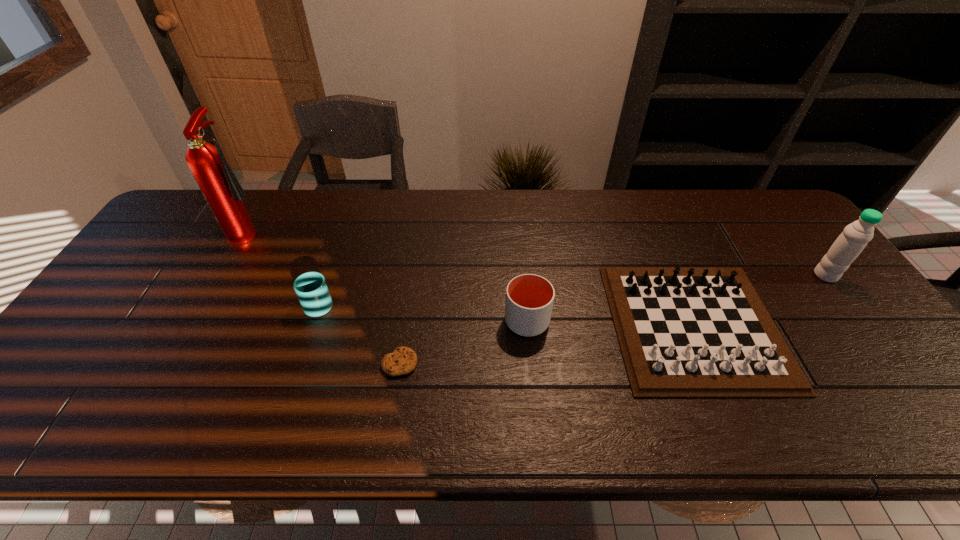
Where is `the leftmost object`? the leftmost object is located at coordinates (220, 187).

What are the coordinates of `the farthest object` in the screenshot? It's located at (220, 187).

You are a GUI agent. You are given a task and a screenshot of the screen. Output one action in this format:
    pyautogui.click(x=<x>, y=<y>)
    Task: Click on the water bottle
    The height and width of the screenshot is (540, 960).
    Given the screenshot: What is the action you would take?
    pyautogui.click(x=855, y=236)

Find the location of a particular element. Image resolution: width=960 pixels, height=540 pixels. the fifth shortest object is located at coordinates (855, 236).

Locate an element on the screen. The height and width of the screenshot is (540, 960). the taller cup is located at coordinates [x=529, y=298].

Identify the location of the third tallest object. This screenshot has height=540, width=960. (529, 298).

You are a GUI agent. You are given a task and a screenshot of the screen. Output one action in this format:
    pyautogui.click(x=<x>, y=<y>)
    Task: Click on the left cup
    The width and height of the screenshot is (960, 540).
    Given the screenshot: What is the action you would take?
    pyautogui.click(x=311, y=289)

You are a GUI agent. You are given a task and a screenshot of the screen. Output one action in this format:
    pyautogui.click(x=<x>, y=<y>)
    Task: Click on the shorter cup
    Image resolution: width=960 pixels, height=540 pixels.
    Given the screenshot: What is the action you would take?
    pyautogui.click(x=311, y=289)

What are the coordinates of `the second object from right to left` in the screenshot? It's located at point(684,332).

The height and width of the screenshot is (540, 960). What are the coordinates of `the second shortest object` in the screenshot? It's located at (684, 332).